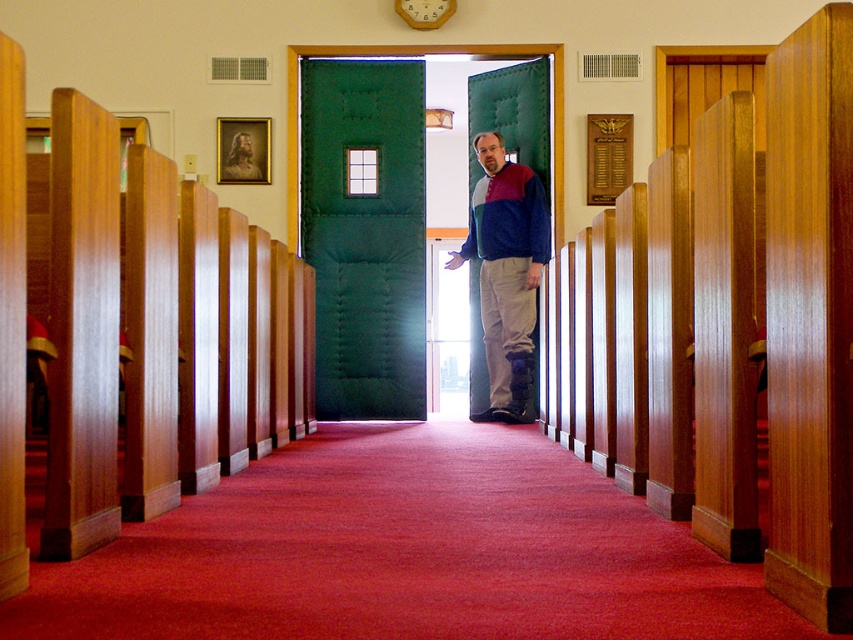
Is carpeted aisle at center smaller than wooden clock at upper center?

No, carpeted aisle at center is not smaller than wooden clock at upper center.

Can you confirm if carpeted aisle at center is positioned to the left of wooden clock at upper center?

No, carpeted aisle at center is not to the left of wooden clock at upper center.

Between point (599, 570) and point (422, 8), which one is positioned behind?

Point (422, 8)

The width and height of the screenshot is (853, 640). Find the location of `carpeted aisle at center`. carpeted aisle at center is located at coordinates (405, 552).

Between matte blue sweater at center and wooden clock at upper center, which one appears on the left side from the viewer's perspective?

wooden clock at upper center is more to the left.

Between point (518, 236) and point (450, 1), which one is positioned behind?

Positioned behind is point (450, 1).

Where is `matte blue sweater at center`? The image size is (853, 640). matte blue sweater at center is located at coordinates (506, 269).

Describe the element at coordinates (405, 552) in the screenshot. I see `carpeted aisle at center` at that location.

Is point (581, 573) farther from camera compared to point (508, 212)?

That is False.

This screenshot has width=853, height=640. What are the coordinates of `carpeted aisle at center` in the screenshot? It's located at (405, 552).